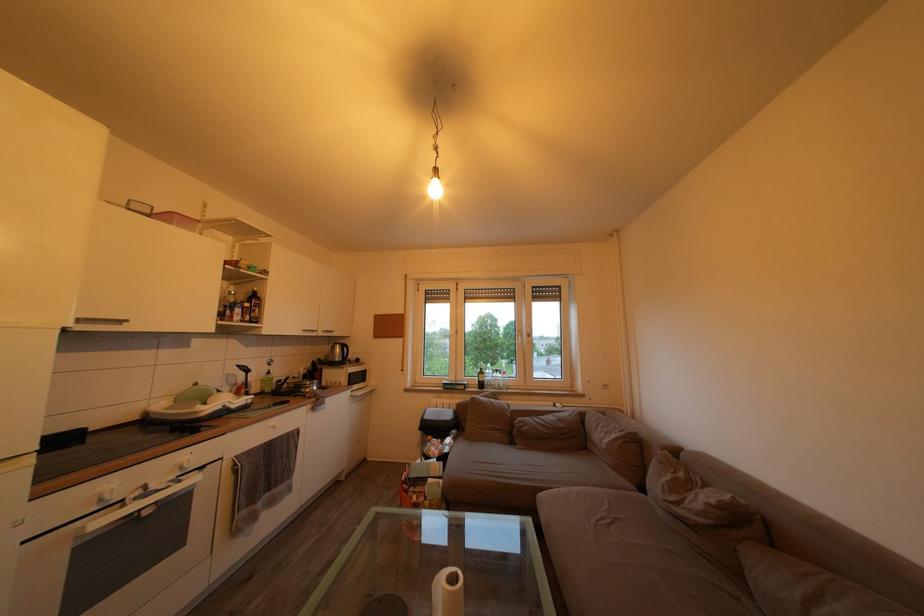
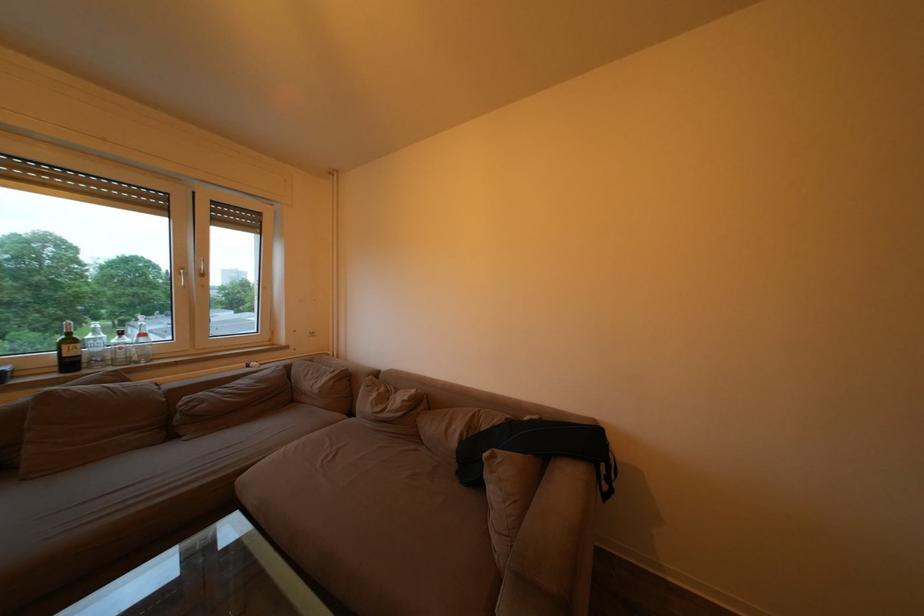
Find the pixel in the second image that matches point 497,385 in the first image.

(107, 355)